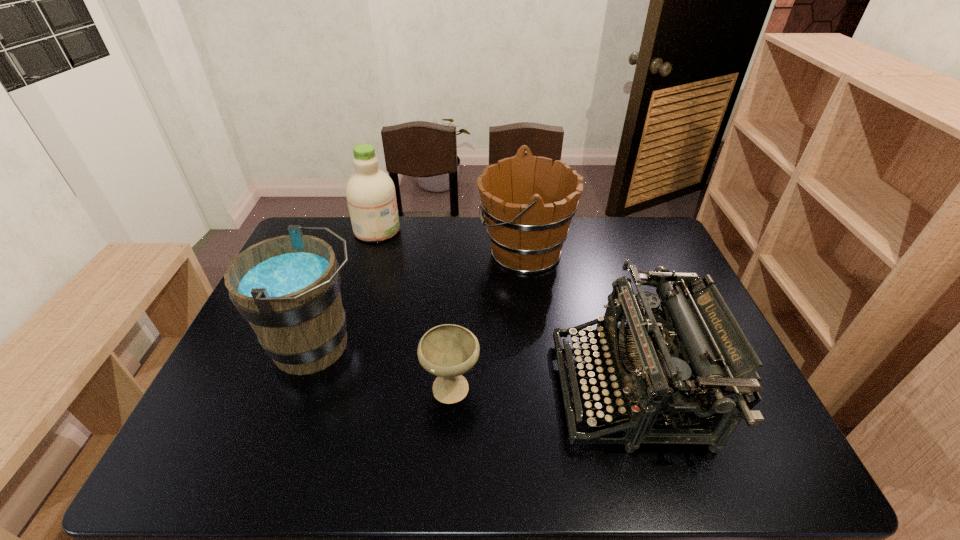
The width and height of the screenshot is (960, 540). I want to click on free spot that satisfies the following two spatial constraints: 1. with a handle on the side of the nearer wine bucket; 2. on the right side of the shortest object, so click(302, 385).

Identify the location of free location that satisfies the following two spatial constraints: 1. on the front label of the cleansing agent; 2. on the back side of the shortest object. (329, 385).